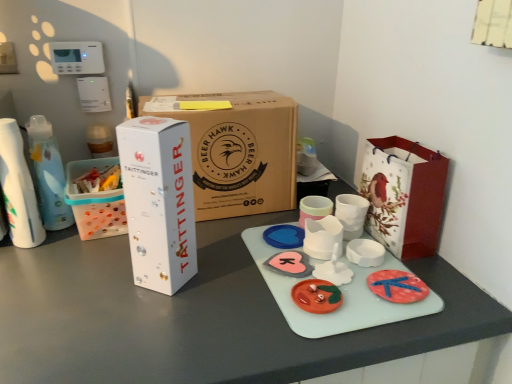
The image size is (512, 384). Identify the location of free area in between matte plastic toy at center, the 4th toy from the back, and white glossy box at left, which ranks as the second box in back-to-front order. (234, 291).